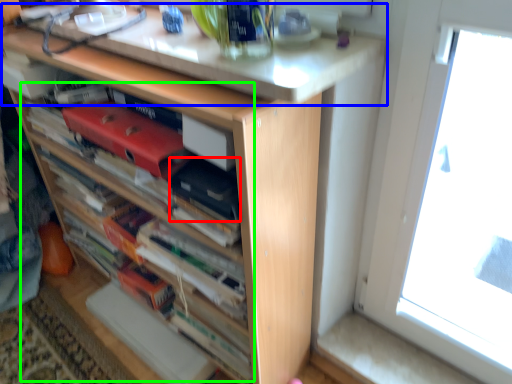
Question: Based on their relative distances, which object is nearer to paperback book (highlighted by a red box)? Choose from counter top (highlighted by a blue box) and book (highlighted by a green box).

Choices:
 (A) counter top
 (B) book

Answer: (A)